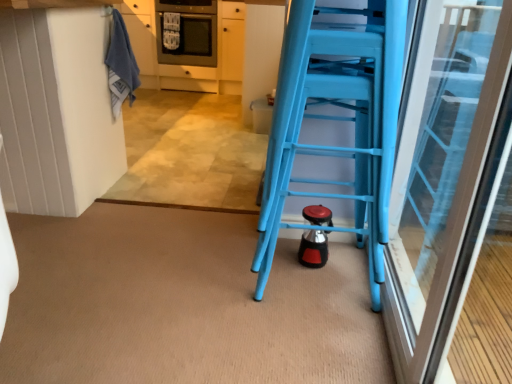
Question: Is blue towel at upper left bigger than blue plastic ladder at right?

Choices:
 (A) yes
 (B) no

Answer: (B)

Question: From a real-world perspective, is blue towel at upper left positioned over blue plastic ladder at right based on gravity?

Choices:
 (A) yes
 (B) no

Answer: (A)

Question: Does blue towel at upper left have a lesser height compared to blue plastic ladder at right?

Choices:
 (A) no
 (B) yes

Answer: (B)

Question: Can we say blue towel at upper left lies outside blue plastic ladder at right?

Choices:
 (A) no
 (B) yes

Answer: (B)

Question: Is blue towel at upper left smaller than blue plastic ladder at right?

Choices:
 (A) no
 (B) yes

Answer: (B)

Question: From a real-world perspective, is blue towel at upper left under blue plastic ladder at right?

Choices:
 (A) yes
 (B) no

Answer: (B)

Question: Considering the relative sizes of satin black oven at upper center and white matte cabinetry at upper left in the image provided, is satin black oven at upper center taller than white matte cabinetry at upper left?

Choices:
 (A) yes
 (B) no

Answer: (B)

Question: From the image's perspective, would you say satin black oven at upper center is shown under white matte cabinetry at upper left?

Choices:
 (A) yes
 (B) no

Answer: (B)

Question: Is white matte cabinetry at upper left completely or partially inside satin black oven at upper center?

Choices:
 (A) yes
 (B) no

Answer: (B)

Question: Is satin black oven at upper center beside white matte cabinetry at upper left?

Choices:
 (A) no
 (B) yes

Answer: (A)

Question: Is satin black oven at upper center bigger than white matte cabinetry at upper left?

Choices:
 (A) no
 (B) yes

Answer: (A)

Question: Would you consider satin black oven at upper center to be distant from white matte cabinetry at upper left?

Choices:
 (A) no
 (B) yes

Answer: (A)

Question: Considering the relative sizes of blue plastic ladder at right and blue towel at upper left in the image provided, is blue plastic ladder at right shorter than blue towel at upper left?

Choices:
 (A) yes
 (B) no

Answer: (B)